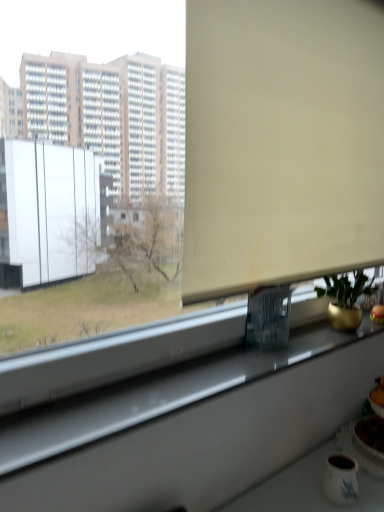
Question: Is gold metallic pot at right far away from white glossy window sill at lower center?

Choices:
 (A) yes
 (B) no

Answer: (B)

Question: From the image's perspective, does gold metallic pot at right appear higher than white glossy window sill at lower center?

Choices:
 (A) no
 (B) yes

Answer: (B)

Question: Is gold metallic pot at right bigger than white glossy window sill at lower center?

Choices:
 (A) yes
 (B) no

Answer: (B)

Question: From a real-world perspective, is gold metallic pot at right physically above white glossy window sill at lower center?

Choices:
 (A) yes
 (B) no

Answer: (A)

Question: Is gold metallic pot at right at the left side of white glossy window sill at lower center?

Choices:
 (A) yes
 (B) no

Answer: (B)

Question: Is white glossy window sill at lower center inside gold metallic pot at right?

Choices:
 (A) yes
 (B) no

Answer: (B)

Question: Is matte white mug at lower right completely or partially inside white glossy window sill at lower center?

Choices:
 (A) no
 (B) yes

Answer: (A)

Question: Can you see white glossy window sill at lower center touching matte white mug at lower right?

Choices:
 (A) yes
 (B) no

Answer: (B)

Question: Does white glossy window sill at lower center lie behind matte white mug at lower right?

Choices:
 (A) yes
 (B) no

Answer: (B)

Question: Is white glossy window sill at lower center far away from matte white mug at lower right?

Choices:
 (A) no
 (B) yes

Answer: (A)

Question: Is white glossy window sill at lower center oriented towards matte white mug at lower right?

Choices:
 (A) yes
 (B) no

Answer: (B)

Question: From the image's perspective, is white glossy window sill at lower center below matte white mug at lower right?

Choices:
 (A) yes
 (B) no

Answer: (B)

Question: From the image's perspective, is white glossy window sill at lower center on top of beige matte window screen at upper center?

Choices:
 (A) yes
 (B) no

Answer: (B)